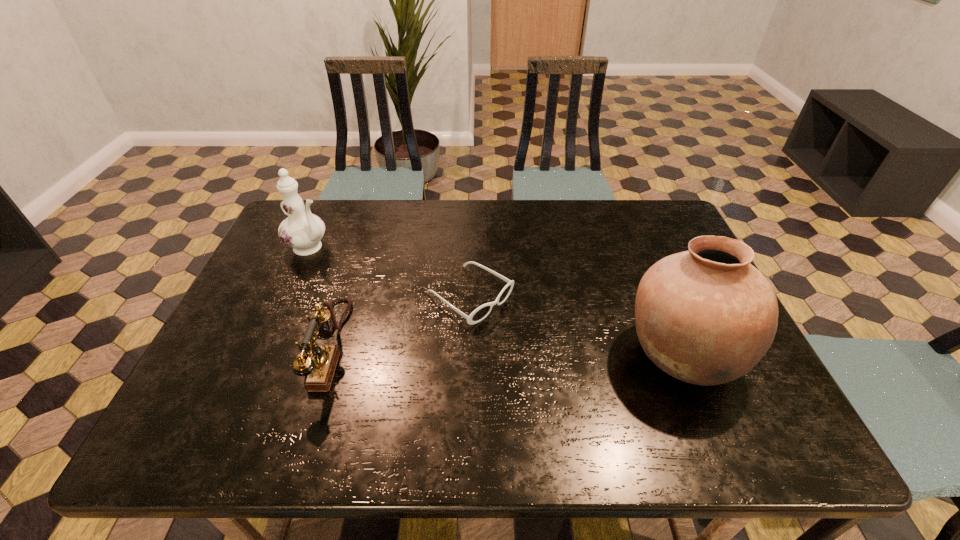
Locate an element on the screen. This screenshot has height=540, width=960. vacant spot on the desktop that is between the third object from right to left and the rightmost object and is positioned with the lenses of the sunglasses facing outward is located at coordinates [x=554, y=351].

Image resolution: width=960 pixels, height=540 pixels. Find the location of `vacant space on the desktop that is between the second shortest object and the pottery and is positioned at the spout of the chinaware`. vacant space on the desktop that is between the second shortest object and the pottery and is positioned at the spout of the chinaware is located at coordinates (490, 350).